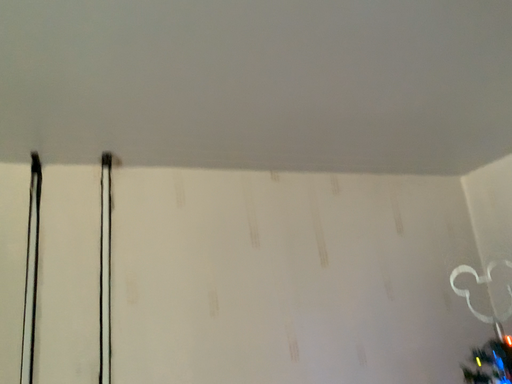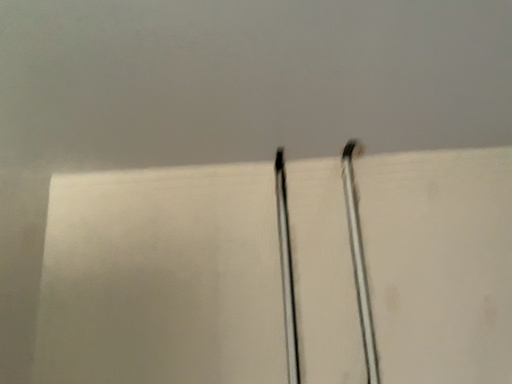
Question: Which way did the camera rotate in the video?

Choices:
 (A) rotated left
 (B) rotated right

Answer: (A)